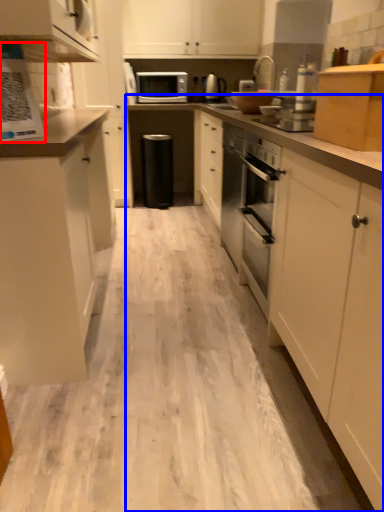
Question: Which point is further to the camera, kitchen appliance (highlighted by a red box) or countertop (highlighted by a blue box)?

Choices:
 (A) kitchen appliance
 (B) countertop

Answer: (A)